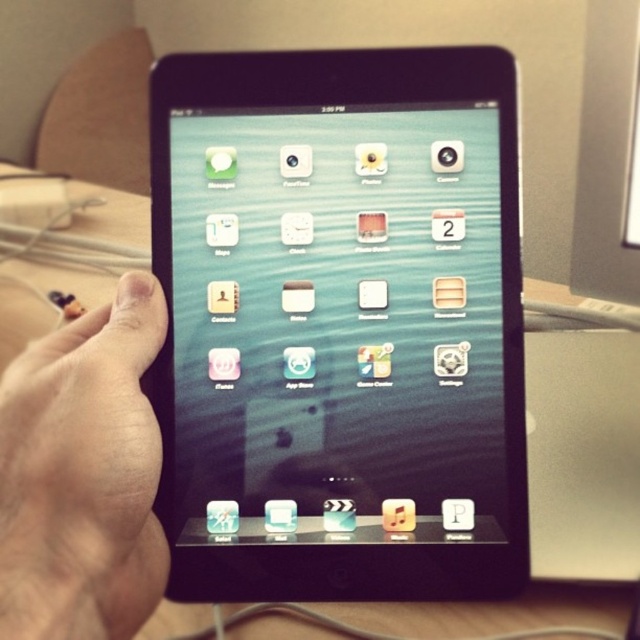
You are trying to determine if the black glossy tablet at center can be placed in a vertical phone stand that is designed to hold items up to 6 inches in height. Given that the skinny beige hand at lower left is 7 inches tall, can the tablet fit?

The black glossy tablet at center is taller than the skinny beige hand at lower left, which is 7 inches tall. Since the tablet is taller than 7 inches, it cannot fit into a stand designed for items up to 6 inches in height.

You are trying to take a photo of the black glossy tablet at center and the skinny beige hand at lower left. Based on their positions, which object is closer to the camera?

The black glossy tablet at center is located above the skinny beige hand at lower left, so the tablet is closer to the camera than the hand.

Based on the photo, you are standing in front of the tablet at center. There is a point at coordinates (339,324) on the tablet. Where exactly is this point located on the tablet?

The point at coordinates (339,324) is on the black glossy tablet at center.